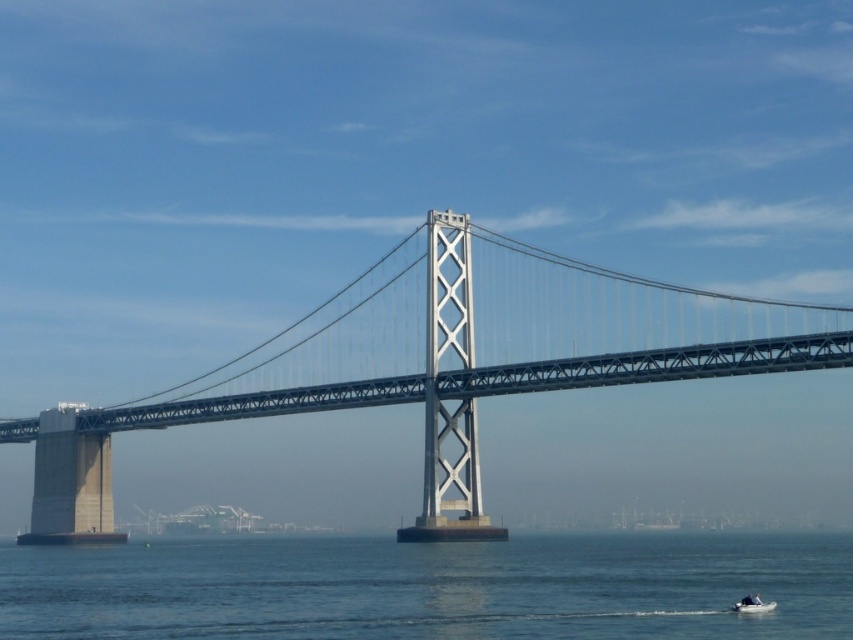
Question: Which point appears closest to the camera in this image?

Choices:
 (A) (457, 392)
 (B) (747, 598)
 (C) (183, 627)

Answer: (B)

Question: Among these objects, which one is farthest from the camera?

Choices:
 (A) white plastic boat at lower right
 (B) metallic gray bridge at center

Answer: (B)

Question: Can you confirm if metallic gray bridge at center is positioned to the left of white plastic boat at lower right?

Choices:
 (A) yes
 (B) no

Answer: (A)

Question: Observing the image, what is the correct spatial positioning of blue water at lower center in reference to white plastic boat at lower right?

Choices:
 (A) left
 (B) right

Answer: (A)

Question: Which object is the closest to the white plastic boat at lower right?

Choices:
 (A) metallic gray bridge at center
 (B) blue water at lower center

Answer: (B)

Question: Is metallic gray bridge at center positioned in front of blue water at lower center?

Choices:
 (A) no
 (B) yes

Answer: (A)